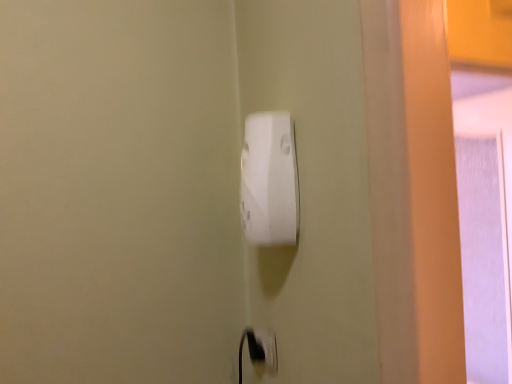
Question: Considering the positions of point (289, 187) and point (272, 370), is point (289, 187) closer or farther from the camera than point (272, 370)?

Choices:
 (A) farther
 (B) closer

Answer: (B)

Question: From a real-world perspective, is white plastic socket at center physically located above or below white plastic electric outlet at lower center?

Choices:
 (A) above
 (B) below

Answer: (A)

Question: Choose the correct answer: Is white plastic socket at center inside white plastic electric outlet at lower center or outside it?

Choices:
 (A) outside
 (B) inside

Answer: (A)

Question: In terms of size, does white plastic electric outlet at lower center appear bigger or smaller than white plastic socket at center?

Choices:
 (A) big
 (B) small

Answer: (B)

Question: From a real-world perspective, relative to white plastic socket at center, is white plastic electric outlet at lower center vertically above or below?

Choices:
 (A) below
 (B) above

Answer: (A)

Question: From the image's perspective, relative to white plastic socket at center, is white plastic electric outlet at lower center above or below?

Choices:
 (A) above
 (B) below

Answer: (B)

Question: Is point (261, 355) closer or farther from the camera than point (259, 226)?

Choices:
 (A) closer
 (B) farther

Answer: (B)